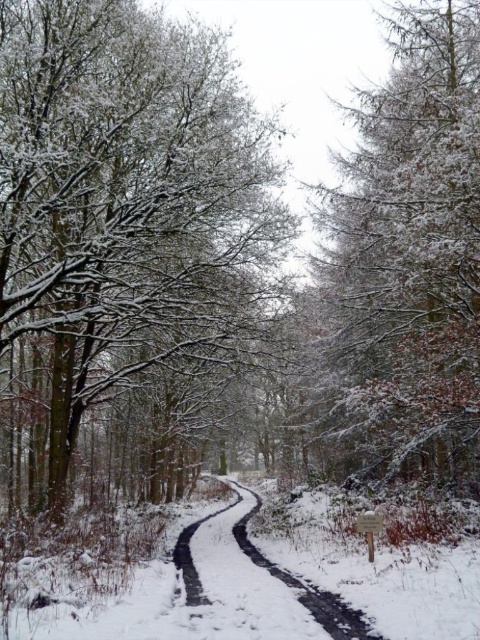
Between point (81, 365) and point (397, 346), which one is positioned in front?

Positioned in front is point (397, 346).

Describe the element at coordinates (123, 212) in the screenshot. I see `snow-covered branches at center` at that location.

Find the location of a particular element. The width and height of the screenshot is (480, 640). snow-covered branches at center is located at coordinates (123, 212).